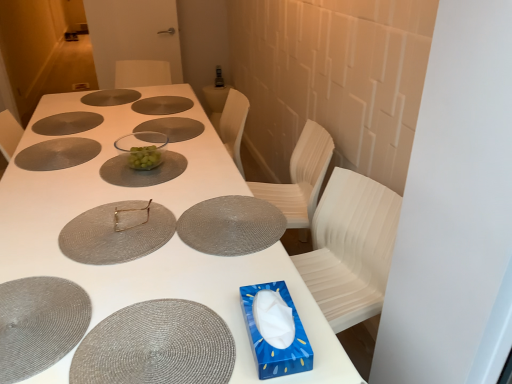
Locate an element on the screen. This screenshot has width=512, height=384. empty space that is in between matte gray placemat at lower center, the ninth glass plate from the back, and blue paper tissue box at lower right is located at coordinates (244, 335).